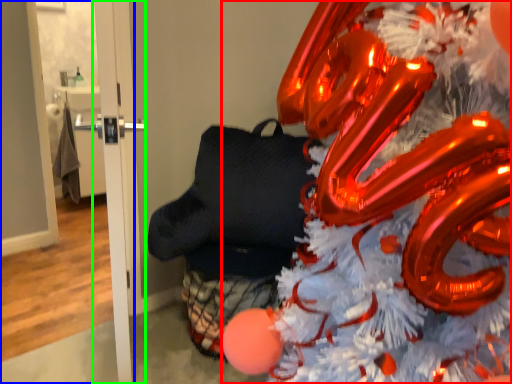
Question: Which object is positioned farthest from christmas tree (highlighted by a red box)? Select from door (highlighted by a blue box) and door (highlighted by a green box).

Choices:
 (A) door
 (B) door

Answer: (A)